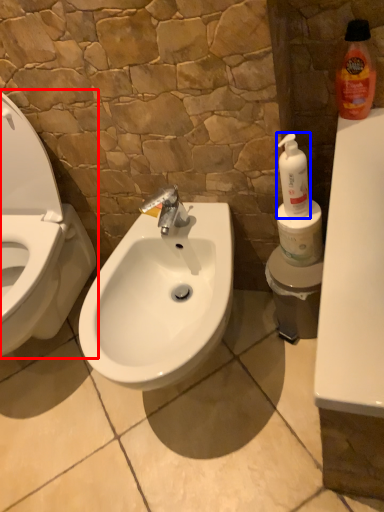
Question: Which object appears closest to the camera in this image, toilet (highlighted by a red box) or cleaning product (highlighted by a blue box)?

Choices:
 (A) toilet
 (B) cleaning product

Answer: (A)